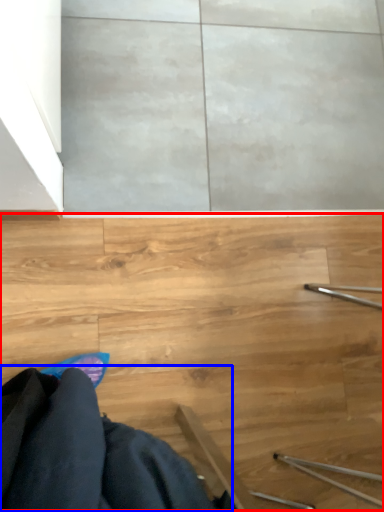
Question: Which point is closer to the camera, stairs (highlighted by a red box) or robe (highlighted by a blue box)?

Choices:
 (A) stairs
 (B) robe

Answer: (B)